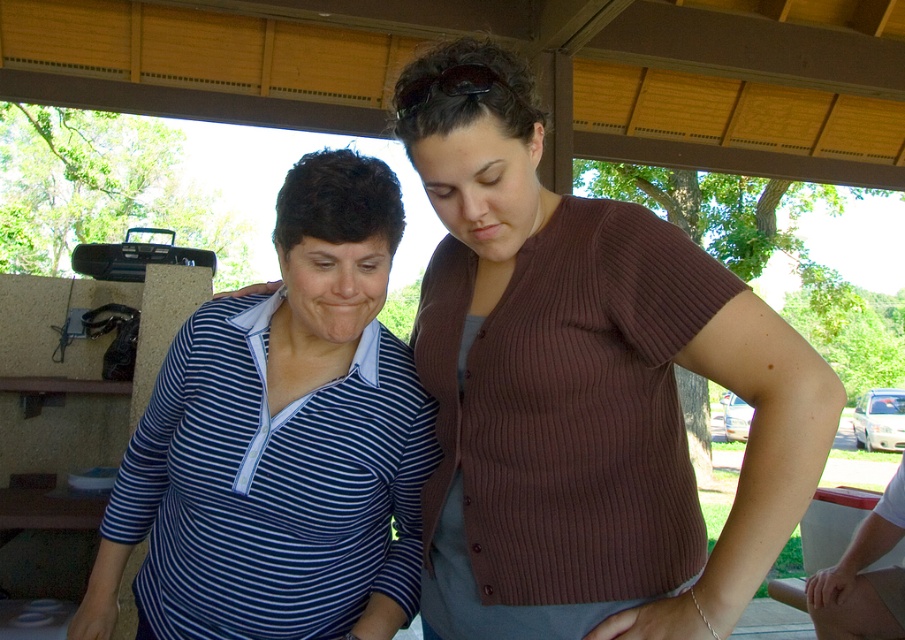
Question: Does striped knit sweater at center come in front of blue striped shirt at center?

Choices:
 (A) yes
 (B) no

Answer: (A)

Question: Which point appears farthest from the camera in this image?

Choices:
 (A) (529, 586)
 (B) (360, 253)

Answer: (B)

Question: Which object is farther from the camera taking this photo?

Choices:
 (A) blue striped shirt at center
 (B) striped knit sweater at center

Answer: (A)

Question: Does striped knit sweater at center come in front of blue striped shirt at center?

Choices:
 (A) yes
 (B) no

Answer: (A)

Question: Is striped knit sweater at center below blue striped shirt at center?

Choices:
 (A) no
 (B) yes

Answer: (A)